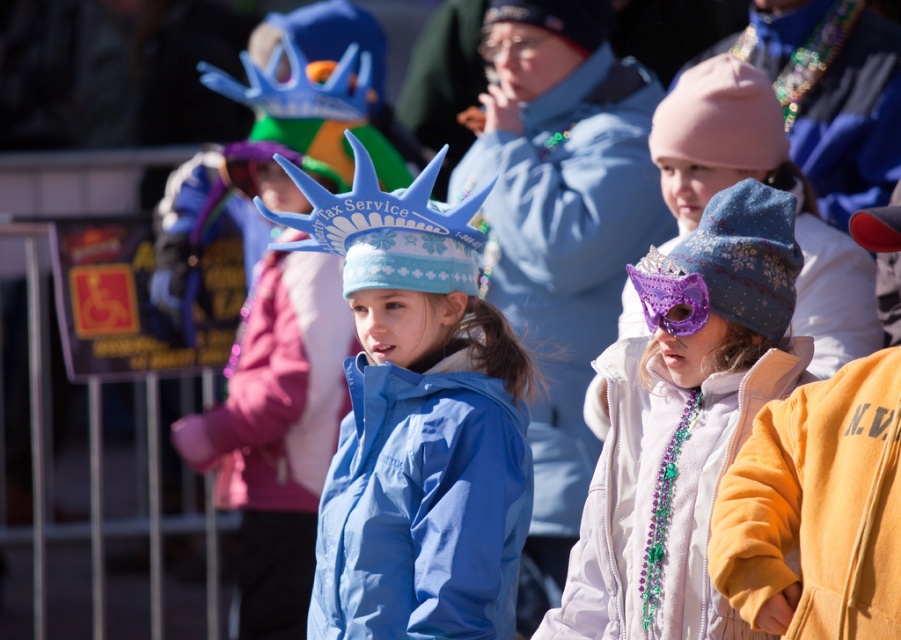
Question: Can you confirm if white fleece jacket at center is bigger than blue matte jacket at center?

Choices:
 (A) no
 (B) yes

Answer: (A)

Question: Considering the real-world distances, which object is closest to the white fleece jacket at center?

Choices:
 (A) blue matte jacket at center
 (B) blue knitted hat at center
 (C) matte blue jacket at center

Answer: (C)

Question: Which object is the farthest from the blue knitted hat at center?

Choices:
 (A) blue matte jacket at center
 (B) yellow fleece jacket at lower right
 (C) matte blue jacket at center

Answer: (A)

Question: Is matte blue hat at center to the right of blue matte jacket at center from the viewer's perspective?

Choices:
 (A) no
 (B) yes

Answer: (B)

Question: Does matte blue hat at center come behind yellow fleece jacket at lower right?

Choices:
 (A) no
 (B) yes

Answer: (B)

Question: Estimate the real-world distances between objects in this image. Which object is closer to the matte blue hat at center?

Choices:
 (A) matte blue jacket at center
 (B) blue knitted hat at center
 (C) white fleece jacket at center
 (D) blue matte jacket at center

Answer: (A)